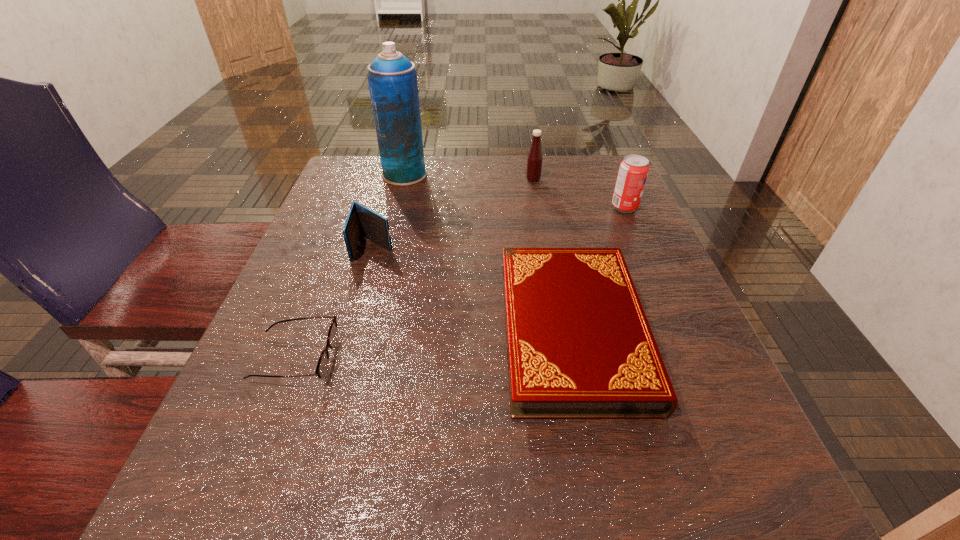
Image resolution: width=960 pixels, height=540 pixels. I want to click on aerosol can, so click(392, 78).

Locate an element on the screen. Tabasco sauce is located at coordinates click(534, 160).

I want to click on the rightmost object, so click(633, 171).

Identify the location of soda can. (633, 171).

Locate an element on the screen. wallet is located at coordinates (360, 220).

The width and height of the screenshot is (960, 540). I want to click on the third shortest object, so click(360, 220).

Image resolution: width=960 pixels, height=540 pixels. Find the location of `hardback book`. hardback book is located at coordinates (579, 346).

You are a GUI agent. You are given a task and a screenshot of the screen. Output one action in this format:
    pyautogui.click(x=<x>, y=<y>)
    Task: Click on the spectacles
    Image resolution: width=960 pixels, height=540 pixels.
    Given the screenshot: What is the action you would take?
    click(x=321, y=371)

Find the location of a particular element. The height and width of the screenshot is (540, 960). blank space located 0.070m on the left of the tallest object is located at coordinates (356, 175).

This screenshot has height=540, width=960. Find the location of `vacant space situated 0.400m on the left of the Tabasco sauce`. vacant space situated 0.400m on the left of the Tabasco sauce is located at coordinates (374, 179).